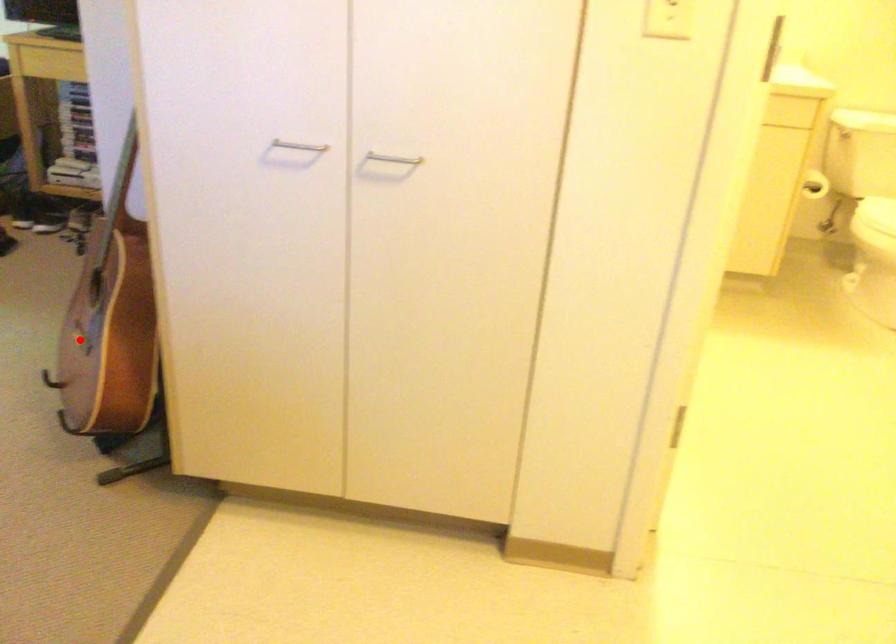
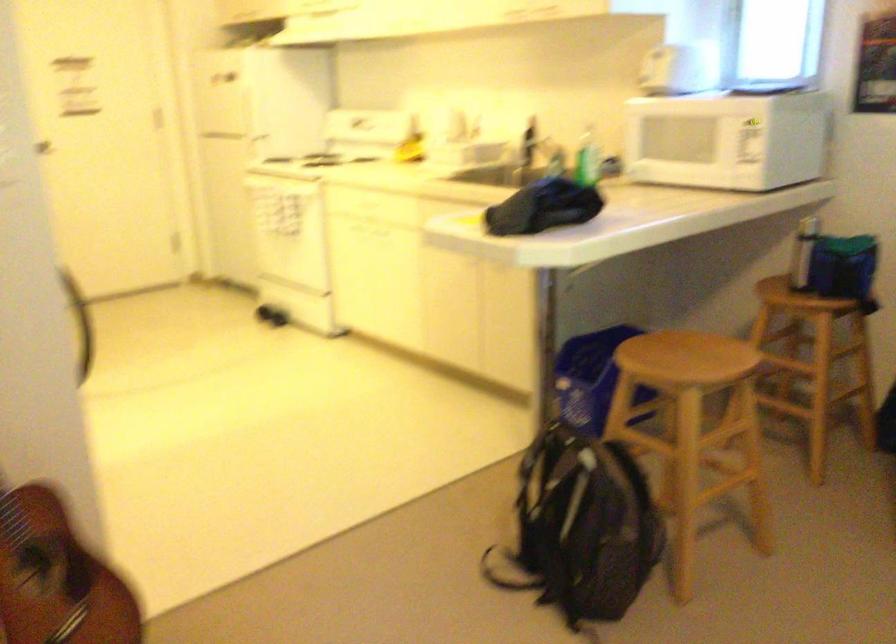
Find the pixel in the second image that matches the highlighted location in the first image.

(56, 576)